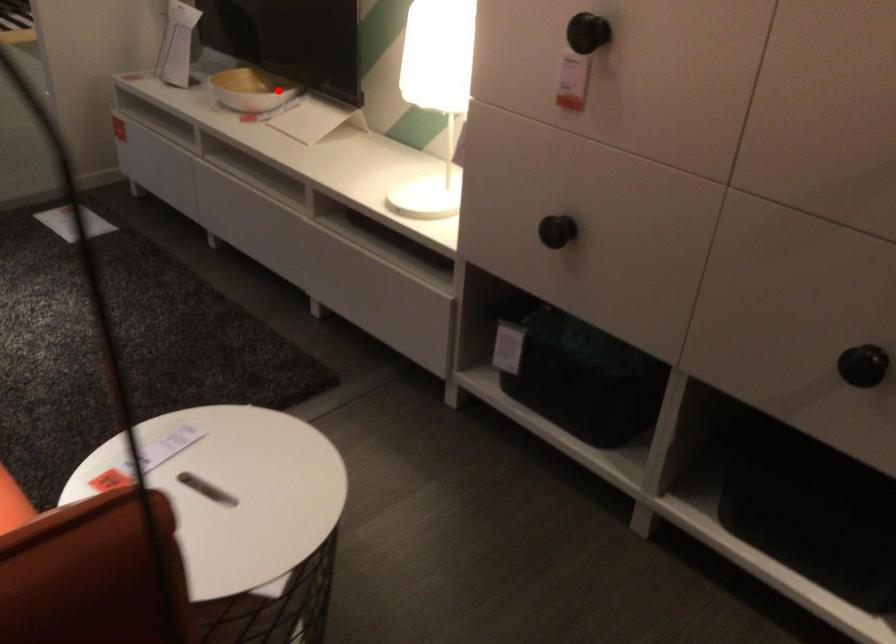
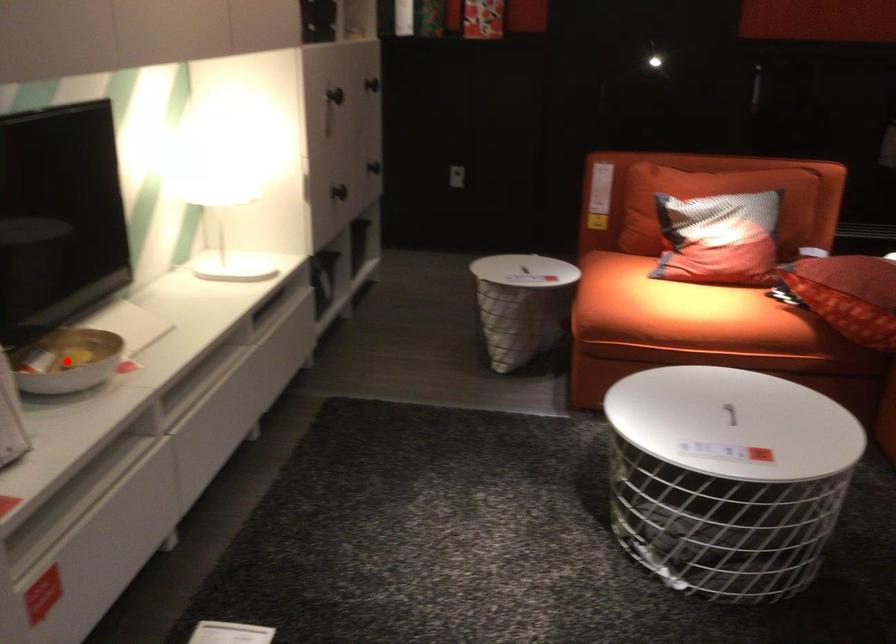
I am providing you with two images of the same scene from different viewpoints. A red point is marked on the first image and another point is marked on the second image. Is the marked point in image1 the same physical position as the marked point in image2?

Yes